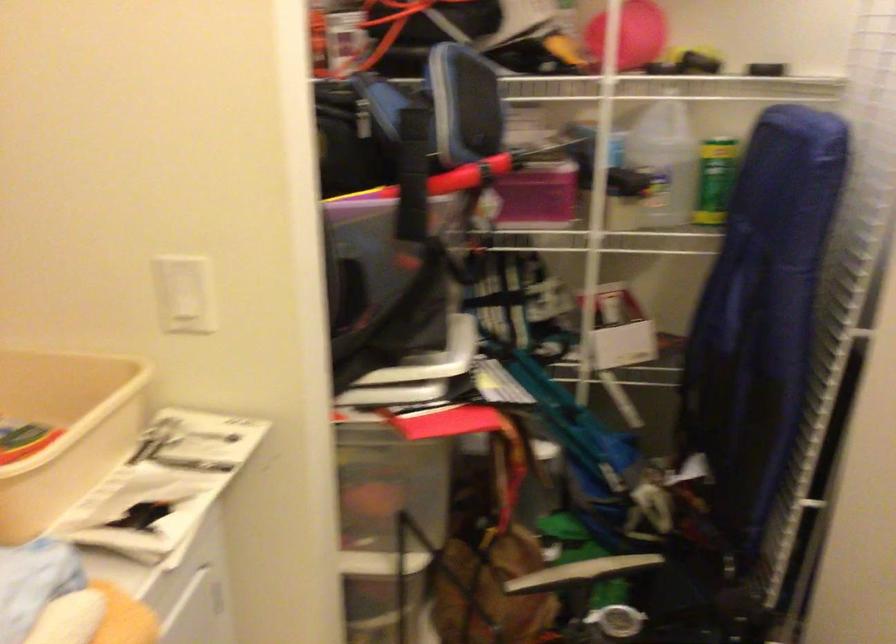
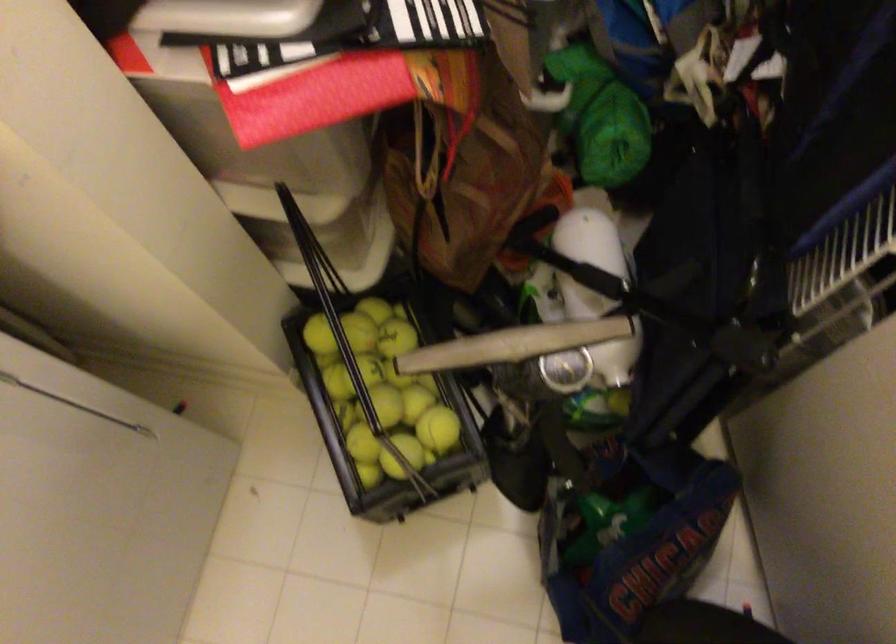
Question: The images are taken continuously from a first-person perspective. In which direction is your viewpoint rotating?

Choices:
 (A) Left
 (B) Right
 (C) Up
 (D) Down

Answer: (D)